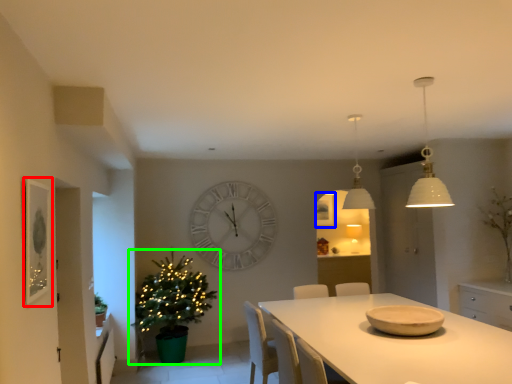
Question: Considering the real-world distances, which object is farthest from picture frame (highlighted by a red box)? picture frame (highlighted by a blue box) or christmas tree (highlighted by a green box)?

Choices:
 (A) picture frame
 (B) christmas tree

Answer: (A)